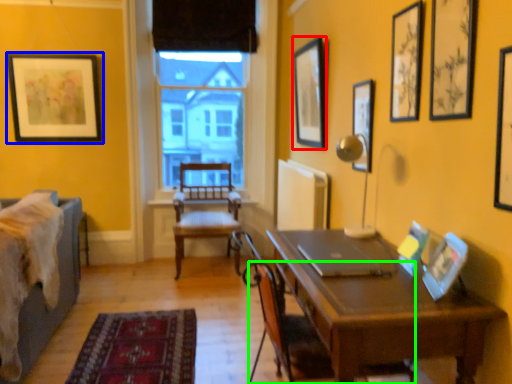
Question: Which is farther away from picture frame (highlighted by a red box)? picture frame (highlighted by a blue box) or chair (highlighted by a green box)?

Choices:
 (A) picture frame
 (B) chair

Answer: (A)